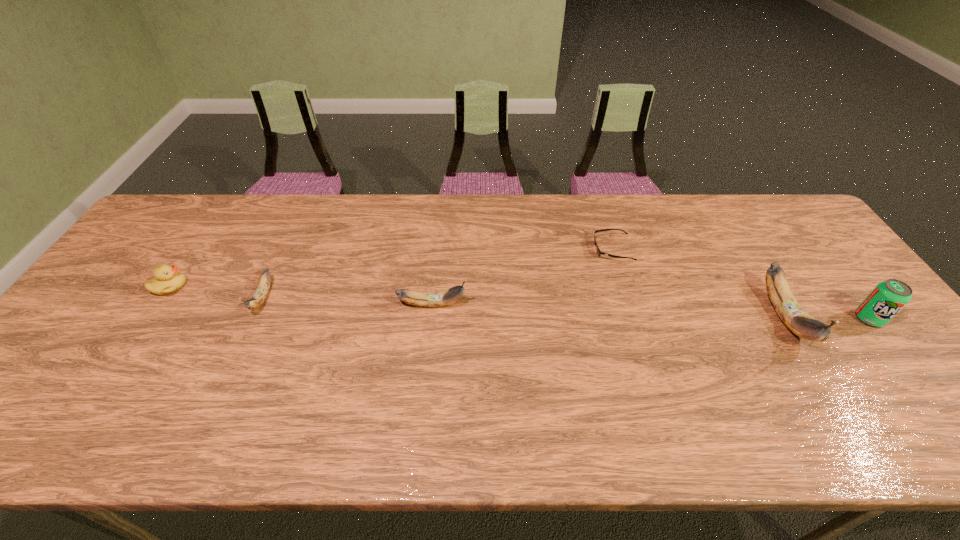
Locate an element on the screen. This screenshot has height=540, width=960. the shortest banana is located at coordinates 260,294.

Image resolution: width=960 pixels, height=540 pixels. Find the location of `the second object from left to right`. the second object from left to right is located at coordinates (260, 294).

Find the location of `the second shortest banana`. the second shortest banana is located at coordinates (440, 298).

Locate an element on the screen. This screenshot has width=960, height=540. the second banana from right to left is located at coordinates click(440, 298).

The image size is (960, 540). Find the location of `the tallest banana`. the tallest banana is located at coordinates (789, 310).

Find the location of `the fifth object from left to right`. the fifth object from left to right is located at coordinates (789, 310).

At what (x,y) coordinates should I click in order to perform the action: click on sunglasses. Please return your answer as a coordinate pair (x, y). This screenshot has height=540, width=960. Looking at the image, I should click on (598, 251).

In order to click on the shortest object in this screenshot , I will do `click(598, 251)`.

You are a GUI agent. You are given a task and a screenshot of the screen. Output one action in this format:
    pyautogui.click(x=<x>, y=<y>)
    Task: Click on the leftmost object
    
    Given the screenshot: What is the action you would take?
    pyautogui.click(x=167, y=280)

I want to click on the rightmost object, so click(x=888, y=297).